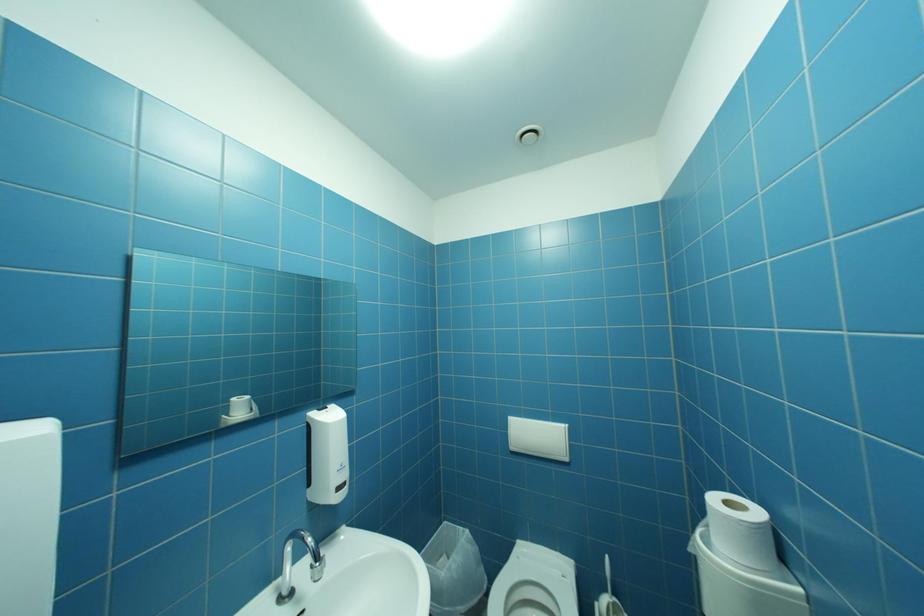
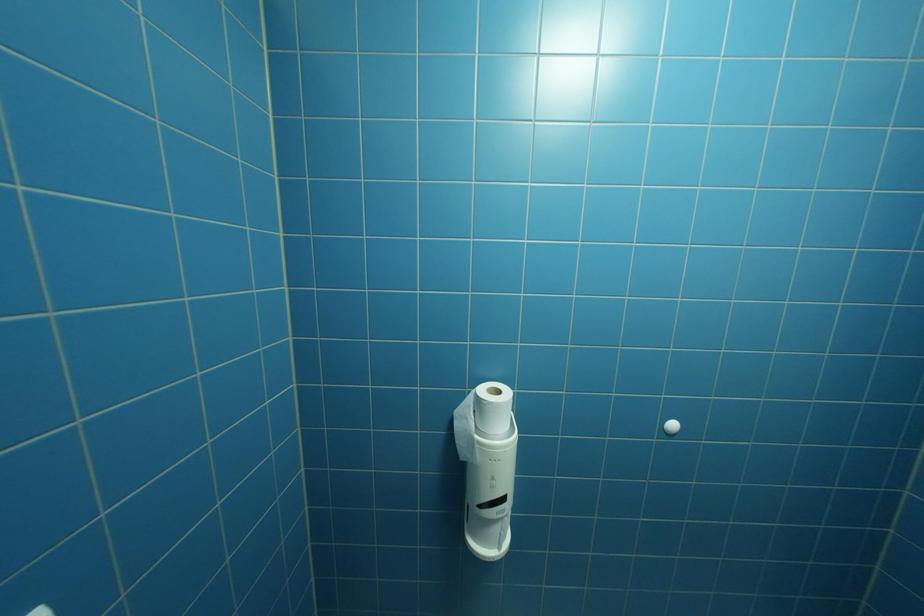
Question: The camera is either moving clockwise (left) or counter-clockwise (right) around the object. The first image is from the beginning of the video and the second image is from the end. Is the camera moving left or right when shooting the video?

Choices:
 (A) Left
 (B) Right

Answer: (A)